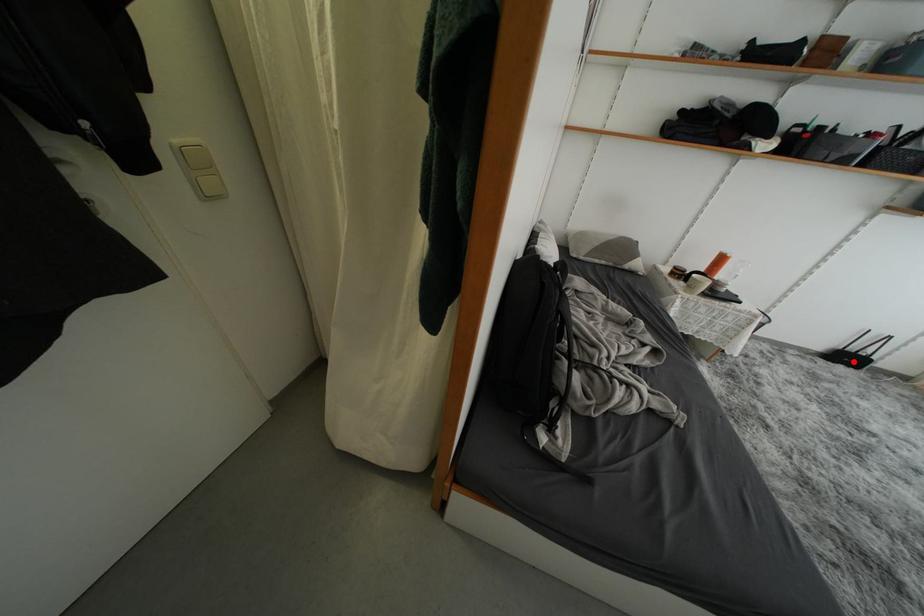
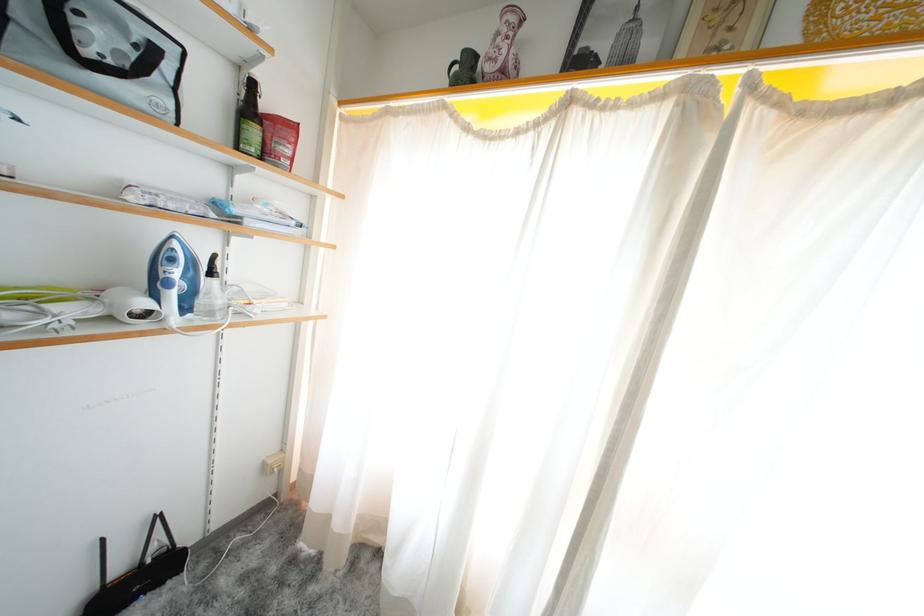
Question: I am providing you with two images of the same scene from different viewpoints. A red point is marked on the first image. Can you still see the location of the red point in image 2?

Choices:
 (A) Yes
 (B) No

Answer: (A)